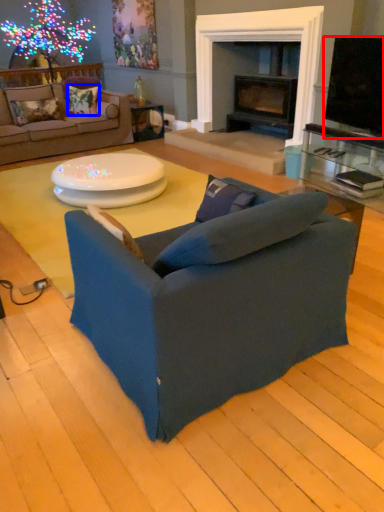
Question: Among these objects, which one is farthest to the camera, television (highlighted by a red box) or pillow (highlighted by a blue box)?

Choices:
 (A) television
 (B) pillow

Answer: (B)